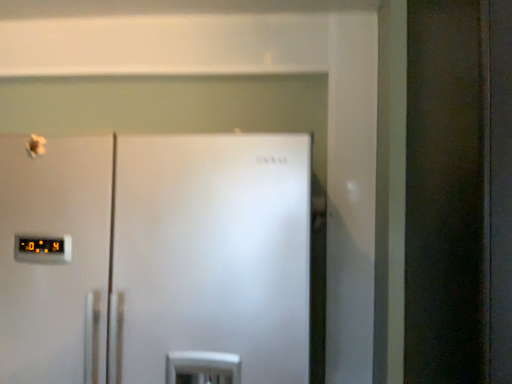
The width and height of the screenshot is (512, 384). Describe the element at coordinates (155, 259) in the screenshot. I see `satin silver refrigerator at center` at that location.

At what (x,y) coordinates should I click in order to perform the action: click on satin silver refrigerator at center. Please return your answer as a coordinate pair (x, y). This screenshot has height=384, width=512. Looking at the image, I should click on (155, 259).

The height and width of the screenshot is (384, 512). What are the coordinates of `satin silver refrigerator at center` in the screenshot? It's located at (155, 259).